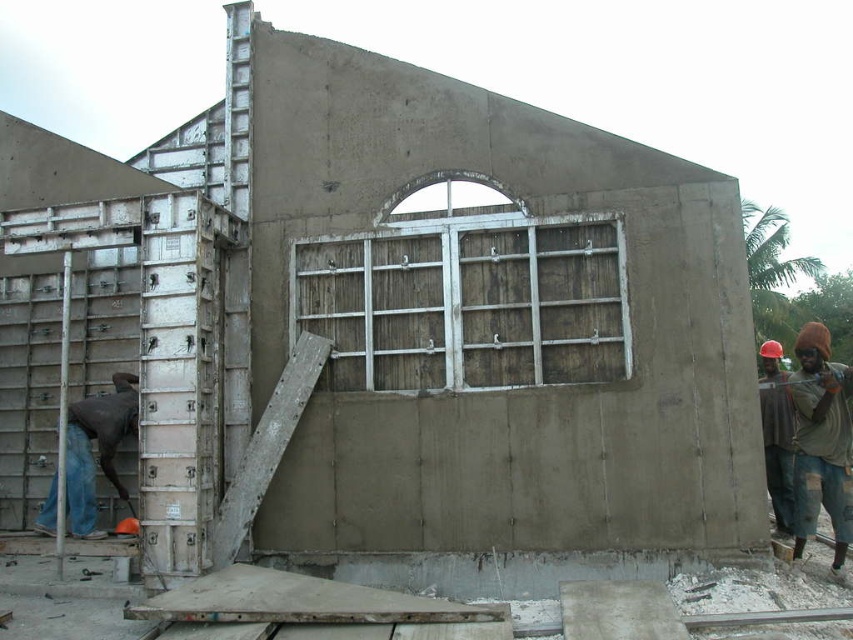
Question: Can you confirm if weathered wood window at center is smaller than brown fabric cap at right?

Choices:
 (A) no
 (B) yes

Answer: (B)

Question: Among these points, which one is farthest from the camera?

Choices:
 (A) (77, 452)
 (B) (845, 467)

Answer: (A)

Question: Which point is farther to the camera?

Choices:
 (A) dark blue jeans at left
 (B) weathered wood window at center

Answer: (A)

Question: Is weathered wood window at center positioned in front of dark blue jeans at left?

Choices:
 (A) yes
 (B) no

Answer: (A)

Question: Is weathered wood window at center thinner than dark blue jeans at left?

Choices:
 (A) no
 (B) yes

Answer: (A)

Question: Which object appears farthest from the camera in this image?

Choices:
 (A) dark blue jeans at left
 (B) brown fabric cap at right
 (C) weathered wood window at center

Answer: (A)